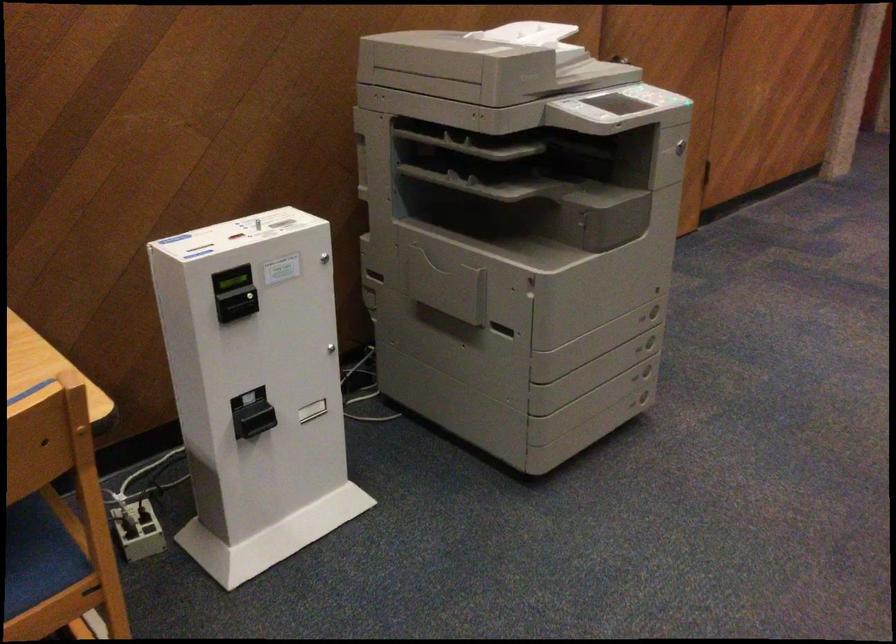
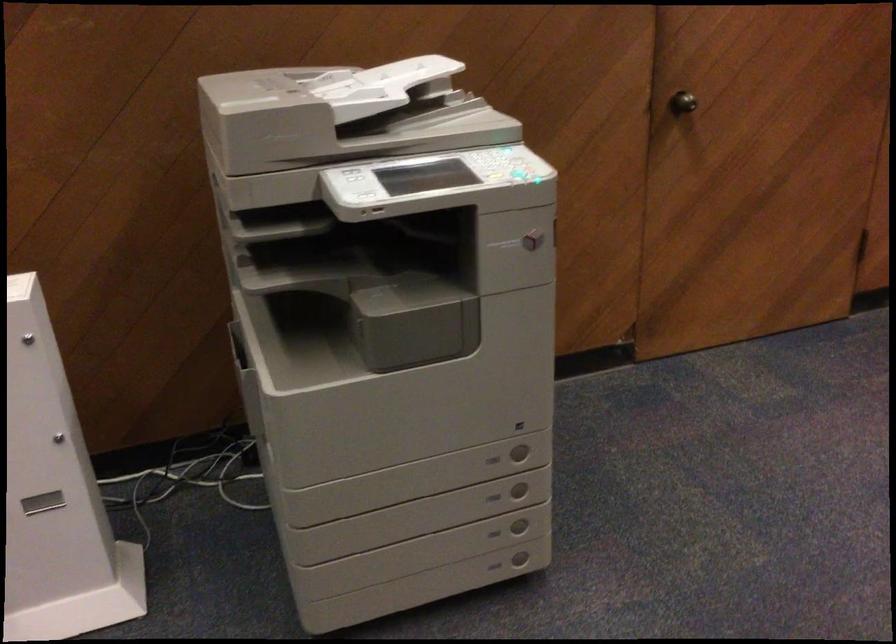
The point at (639, 377) is marked in the first image. Where is the corresponding point in the second image?

(494, 533)